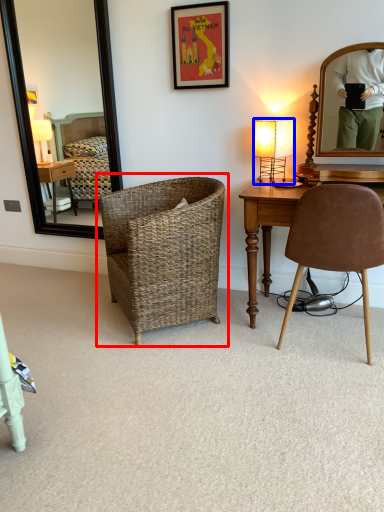
Question: Among these objects, which one is nearest to the camera, chair (highlighted by a red box) or lamp (highlighted by a blue box)?

Choices:
 (A) chair
 (B) lamp

Answer: (A)